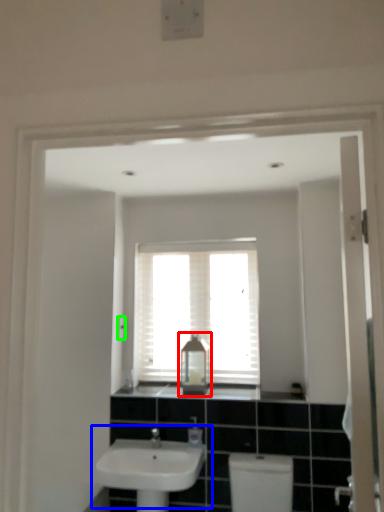
Question: Which object is positioned closest to medicine cabinet (highlighted by a red box)? Select from sink (highlighted by a blue box) and light switch (highlighted by a green box).

Choices:
 (A) sink
 (B) light switch

Answer: (A)